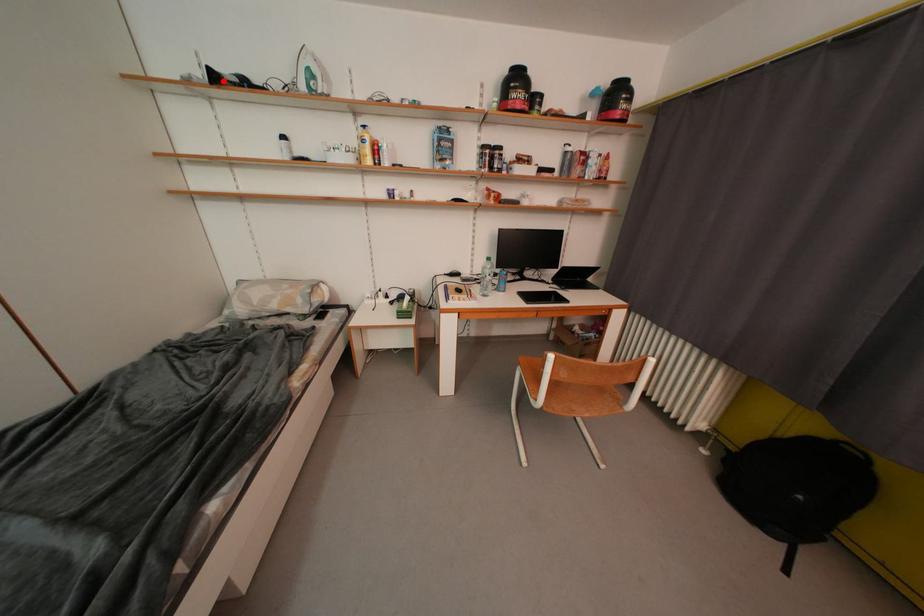
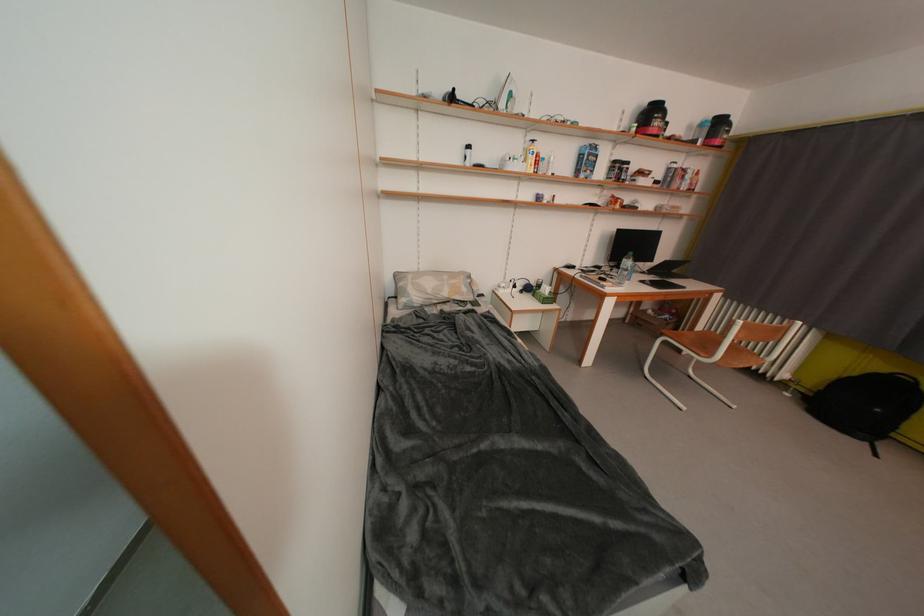
Find the pixel in the second image that matches the highlighted location in the first image.

(459, 100)